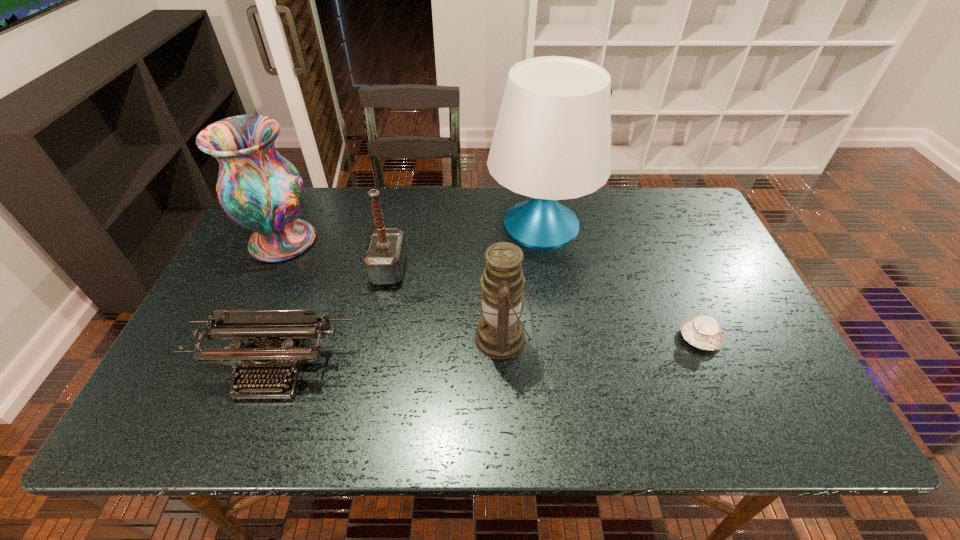
Where is `free space between the second shortest object and the hammer`? free space between the second shortest object and the hammer is located at coordinates (332, 319).

You are a GUI agent. You are given a task and a screenshot of the screen. Output one action in this format:
    pyautogui.click(x=<x>, y=<y>)
    Task: Click on the vacant space in between the oil lamp and the rightmost object
    The image size is (960, 540).
    Given the screenshot: What is the action you would take?
    pyautogui.click(x=601, y=338)

Find the location of a particular element. The height and width of the screenshot is (540, 960). free space between the hammer and the typewriter is located at coordinates (332, 319).

Identify the location of vacant point located between the typewriter and the oil lamp. (389, 353).

Image resolution: width=960 pixels, height=540 pixels. I want to click on free space between the vase and the hammer, so click(x=336, y=255).

Find the location of a particular element. free space that is in between the second shortest object and the oil lamp is located at coordinates 389,353.

You are a GUI agent. You are given a task and a screenshot of the screen. Output one action in this format:
    pyautogui.click(x=<x>, y=<y>)
    Task: Click on the object that stands as the second closest to the oil lamp
    
    Given the screenshot: What is the action you would take?
    pyautogui.click(x=385, y=255)

You are a GUI agent. You are given a task and a screenshot of the screen. Output one action in this format:
    pyautogui.click(x=<x>, y=<y>)
    Task: Click on the object that is the closest to the second tallest object
    
    Given the screenshot: What is the action you would take?
    pyautogui.click(x=385, y=255)

This screenshot has width=960, height=540. I want to click on free region that satisfies the following two spatial constraints: 1. on the front-facing side of the tallest object; 2. on the front side of the oil lamp, so click(558, 338).

The image size is (960, 540). In order to click on free space that satisfies the following two spatial constraints: 1. on the front-facing side of the tallest object; 2. on the typing side of the typewriter in this screenshot , I will do `click(563, 369)`.